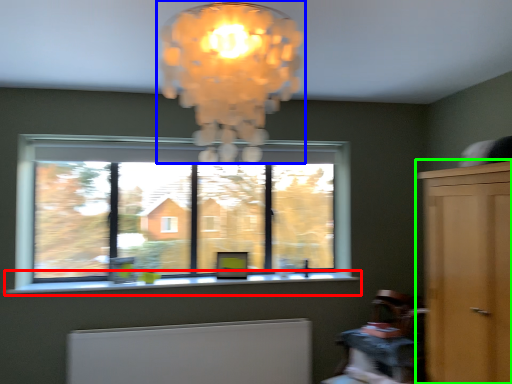
Question: Based on their relative distances, which object is farther from window sill (highlighted by a red box)? Choose from lamp (highlighted by a blue box) and dresser (highlighted by a green box).

Choices:
 (A) lamp
 (B) dresser

Answer: (A)